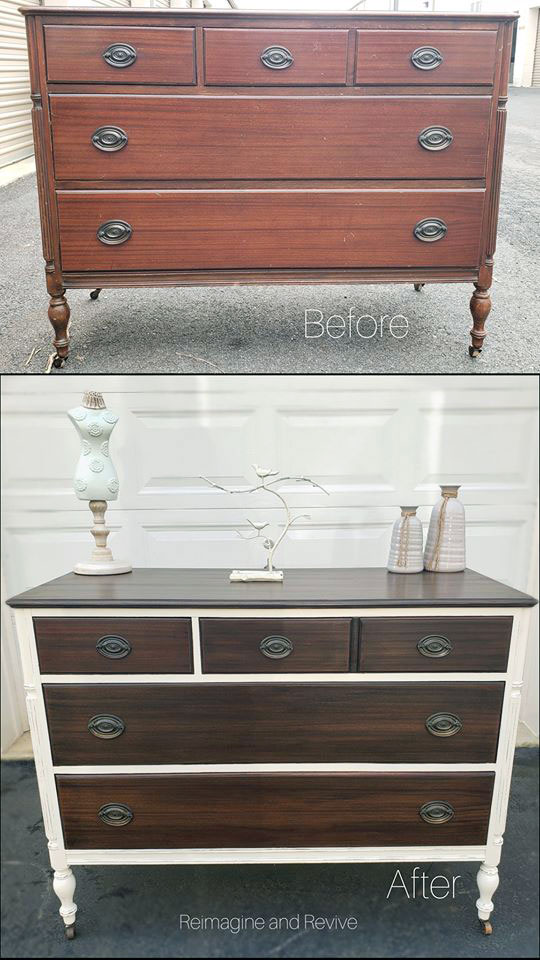
Identify the location of after bottom drawer. (302, 789).